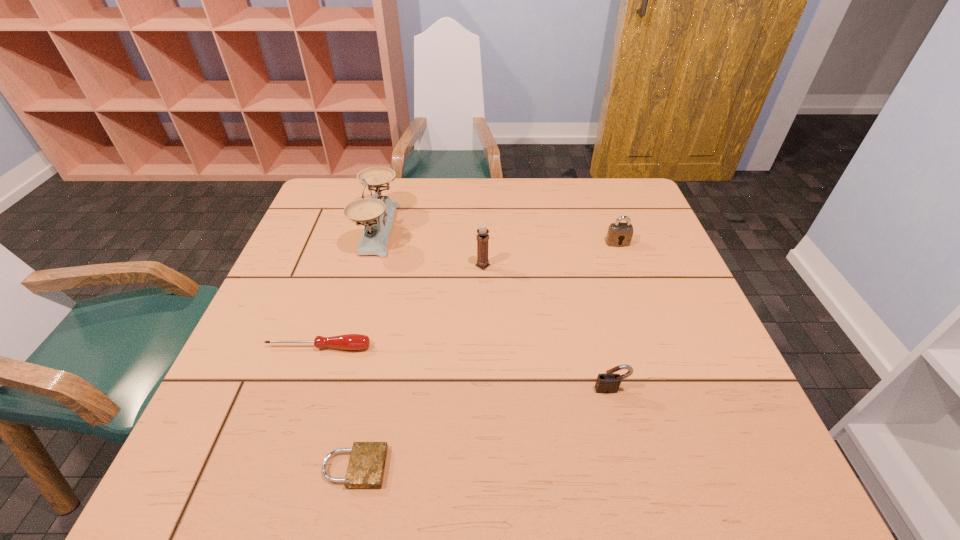
At what (x,y) coordinates should I click in order to perform the action: click on the shortest padlock. Please return your answer as a coordinate pair (x, y). Image resolution: width=960 pixels, height=540 pixels. Looking at the image, I should click on (367, 461).

I want to click on free region located 0.330m on the front-facing side of the tallest object, so click(511, 229).

Where is `free space located 0.250m on the left of the candle holder`? free space located 0.250m on the left of the candle holder is located at coordinates (380, 266).

Identify the location of blank area located 0.400m at the front of the farthest padlock near the keyhole. (663, 368).

Find the location of `vacant space located with the keyhole on the front of the second farthest padlock`. vacant space located with the keyhole on the front of the second farthest padlock is located at coordinates (617, 417).

I want to click on free space located 0.210m on the right of the fourth farthest object, so click(x=468, y=347).

Locate an element on the screen. This screenshot has width=960, height=540. free region located 0.200m on the keyhole side of the shortest object is located at coordinates (499, 467).

The image size is (960, 540). I want to click on object that is at the far edge, so click(378, 211).

Image resolution: width=960 pixels, height=540 pixels. I want to click on object at the near edge, so click(x=367, y=461).

The height and width of the screenshot is (540, 960). I want to click on object that is positioned at the left edge, so click(x=348, y=341).